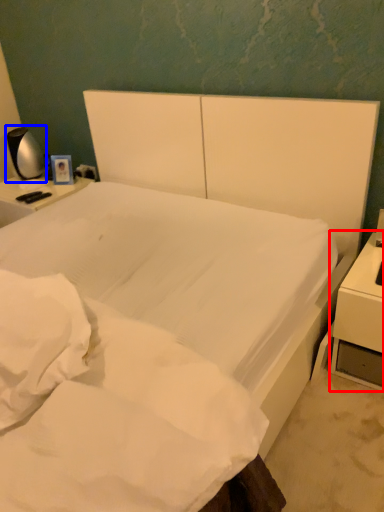
Question: Which object appears farthest to the camera in this image, nightstand (highlighted by a red box) or bedside lamp (highlighted by a blue box)?

Choices:
 (A) nightstand
 (B) bedside lamp

Answer: (B)